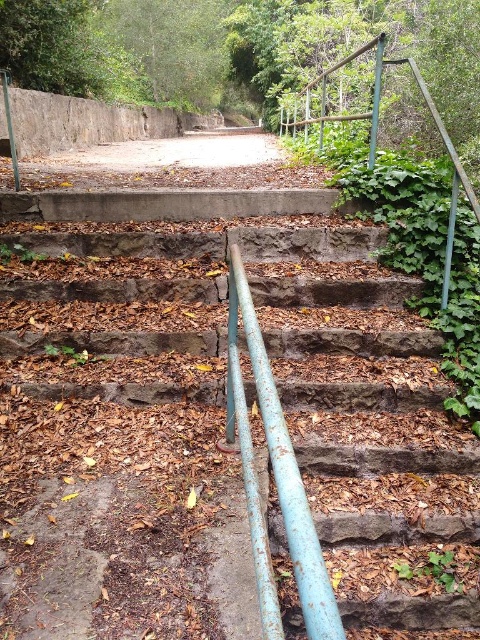
The height and width of the screenshot is (640, 480). I want to click on rusty metal rail at center, so click(275, 477).

Describe the element at coordinates (275, 477) in the screenshot. This screenshot has width=480, height=640. I see `rusty metal rail at center` at that location.

Find the location of a particular element. This screenshot has height=640, width=480. rusty metal rail at center is located at coordinates (275, 477).

Is rusty metal railing at center bigger than rusty metal rail at center?

Yes, rusty metal railing at center is bigger than rusty metal rail at center.

Is rusty metal railing at center taller than rusty metal rail at center?

Correct, rusty metal railing at center is much taller as rusty metal rail at center.

Does point (355, 595) come closer to viewer compared to point (276, 474)?

That is False.

Where is `rusty metal railing at center`? rusty metal railing at center is located at coordinates (324, 385).

Is rusty metal railing at center taller than rusty metal railing at upper right?

Incorrect, rusty metal railing at center's height is not larger of rusty metal railing at upper right's.

Which of these two, rusty metal railing at center or rusty metal railing at upper right, stands taller?

With more height is rusty metal railing at upper right.

Is point (75, 545) positioned after point (363, 45)?

No, (75, 545) is closer to viewer.

I want to click on rusty metal railing at center, so click(324, 385).